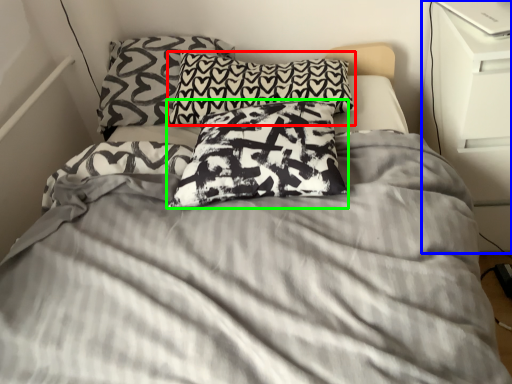
Question: Based on their relative distances, which object is farther from pillow (highlighted by a red box)? Choose from dresser (highlighted by a blue box) and pillow (highlighted by a green box).

Choices:
 (A) dresser
 (B) pillow

Answer: (A)